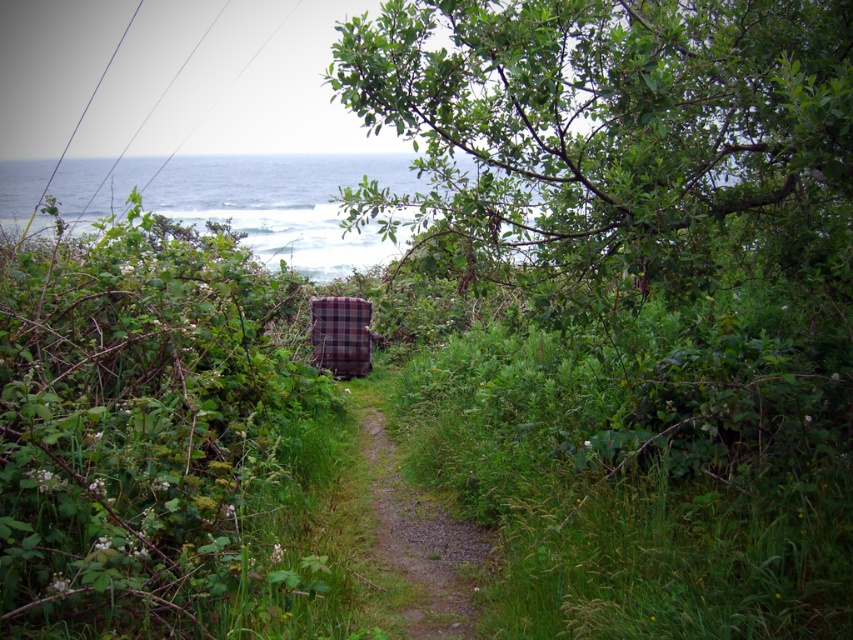
You are a hiker who wants to take a photo of the green leafy tree at upper center while standing on the gravelly dirt path at center. Which direction should you face to capture the tree in your shot?

The green leafy tree at upper center is to the right of gravelly dirt path at center, so you should face to the right to capture the tree in your shot.

You are a hiker trying to reach the ocean and see the gravelly dirt path at center and the plaid fabric armchair at center. Which object is closer to the ocean?

The gravelly dirt path at center is positioned under plaid fabric armchair at center, meaning the path is closer to the ocean than the chair.